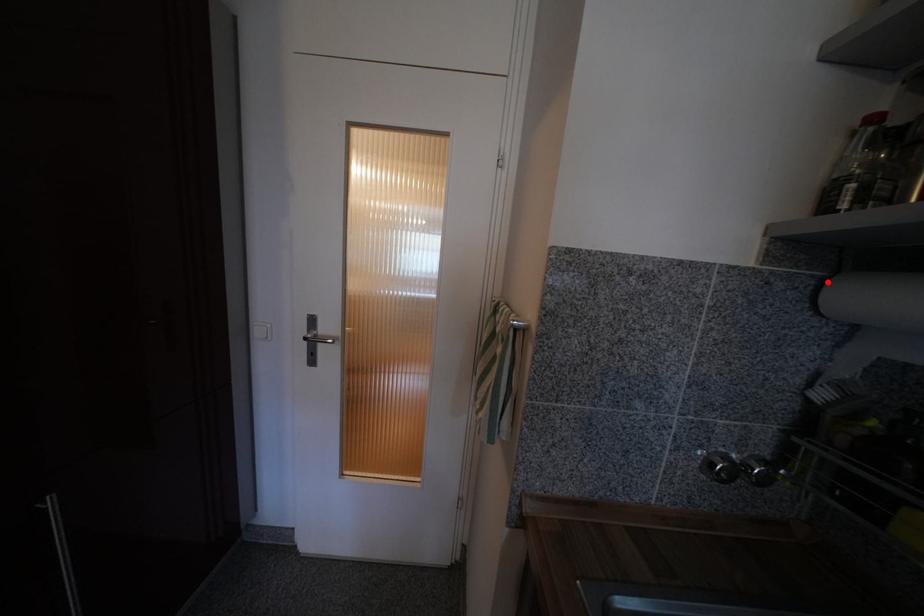
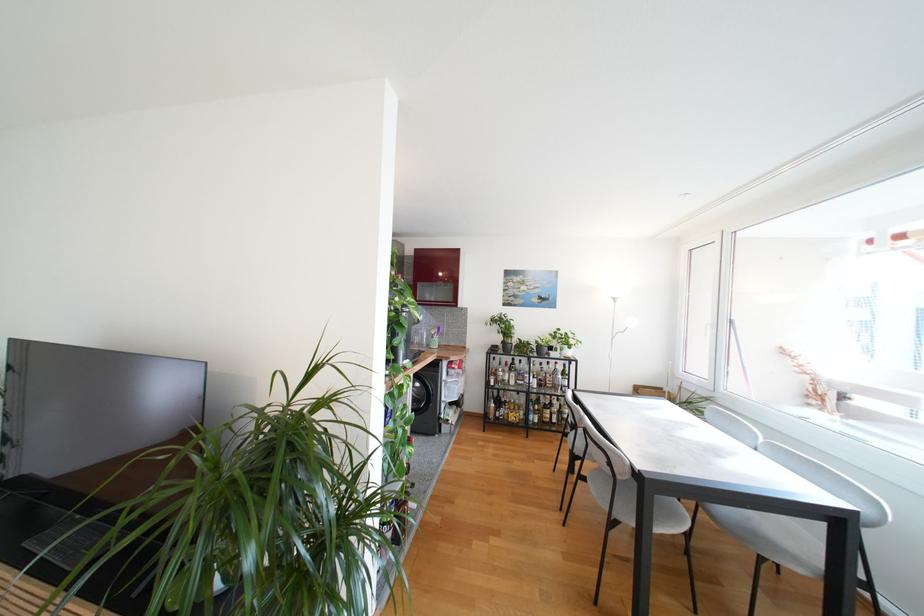
Question: I am providing you with two images of the same scene from different viewpoints. A red point is marked on the first image. At the location where the point appears in image 1, is it still visible in image 2?

Choices:
 (A) Yes
 (B) No

Answer: (B)